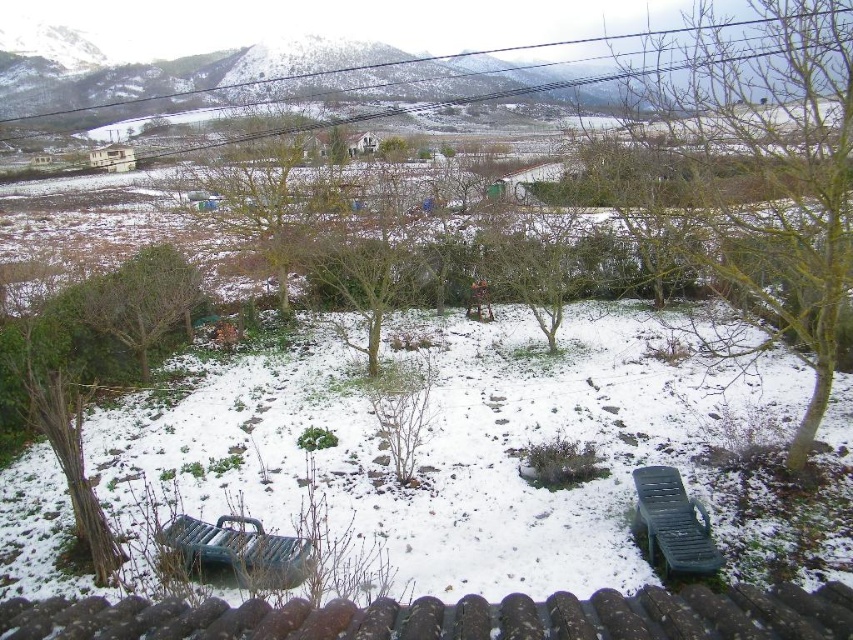
Question: Which of these objects is positioned farthest from the green leafy tree at left?

Choices:
 (A) green plastic park bench at lower center
 (B) bare wood tree at center

Answer: (B)

Question: Which point appears closest to the camera in this image?

Choices:
 (A) (270, 541)
 (B) (666, 477)

Answer: (A)

Question: Does green leafy tree at left appear on the right side of green plastic park bench at lower right?

Choices:
 (A) yes
 (B) no

Answer: (B)

Question: Is the position of bare wood tree at center more distant than that of green plastic park bench at lower right?

Choices:
 (A) no
 (B) yes

Answer: (B)

Question: Which of the following is the farthest from the observer?

Choices:
 (A) green plastic park bench at lower center
 (B) green plastic park bench at lower right
 (C) bare wood tree at center
 (D) green leafy tree at left

Answer: (D)

Question: Does green leafy tree at left appear on the left side of green plastic park bench at lower right?

Choices:
 (A) yes
 (B) no

Answer: (A)